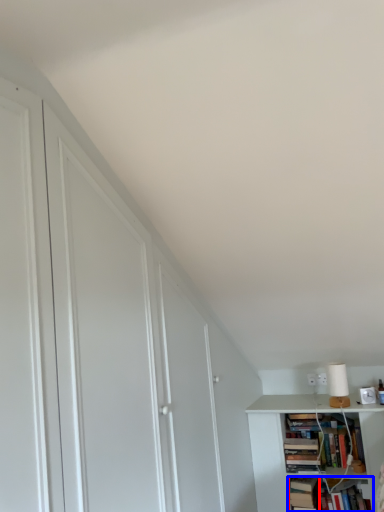
Question: Among these objects, which one is nearest to the camera, book (highlighted by a red box) or book (highlighted by a blue box)?

Choices:
 (A) book
 (B) book

Answer: (B)